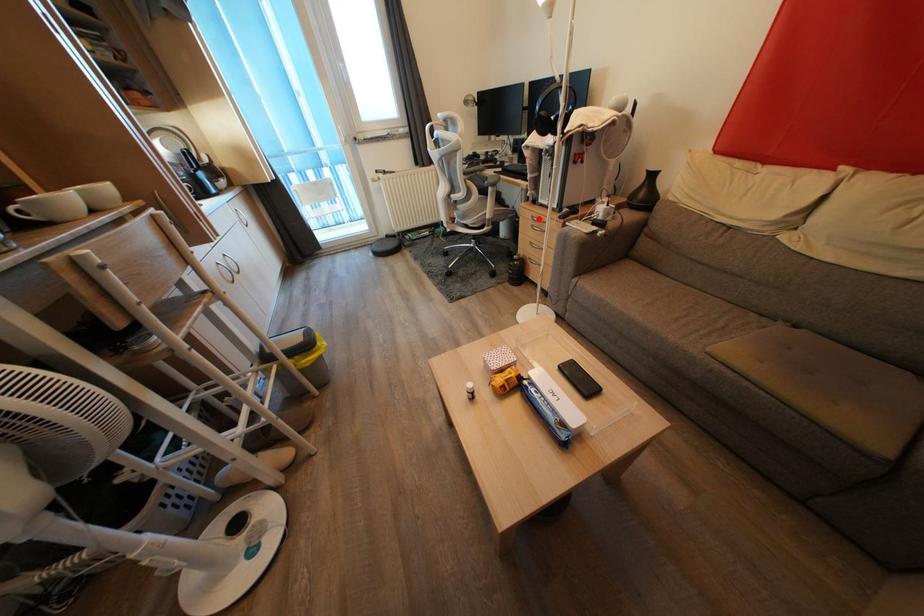
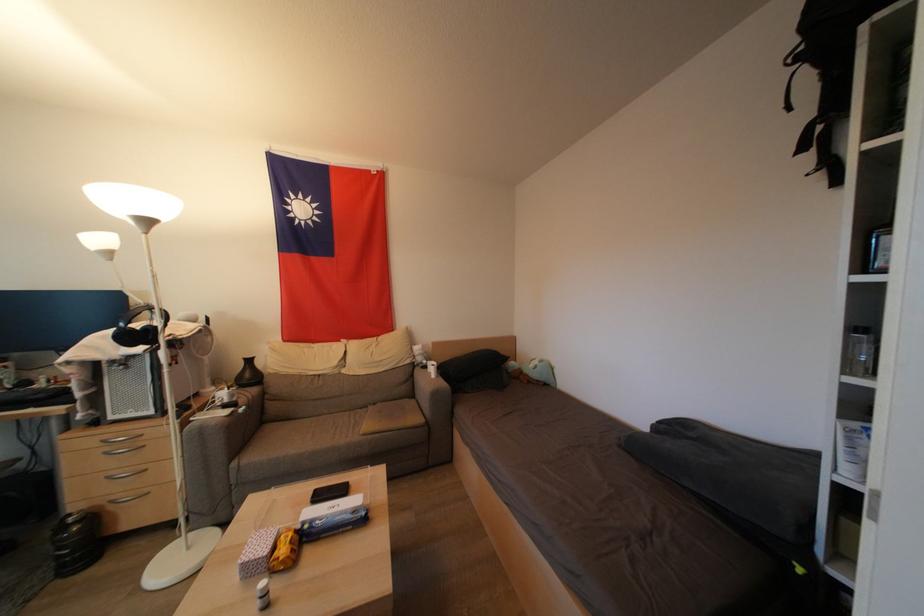
Question: I am providing you with two images of the same scene from different viewpoints. A red point is marked on the first image. Can you still see the location of the red point in image 2?

Choices:
 (A) Yes
 (B) No

Answer: (A)